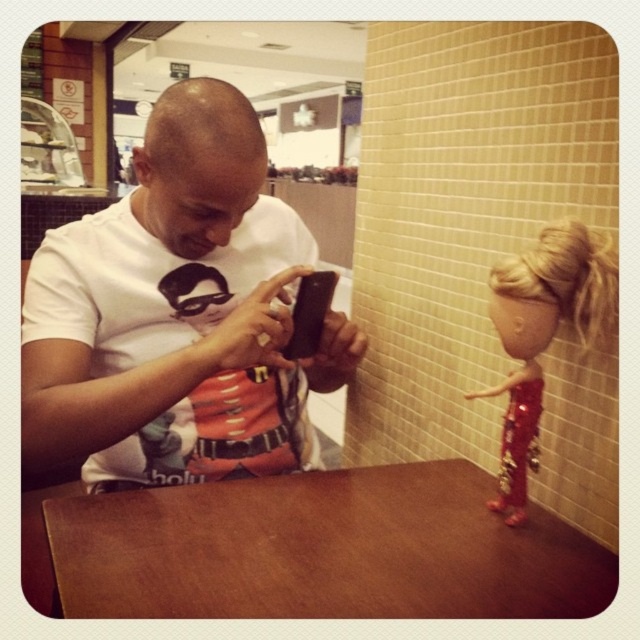
You are standing in the food court and want to find the brown matte table at lower center. According to the coordinates provided, can you locate it at point (323,550)?

Yes, the brown matte table at lower center is located exactly at point (323,550).

You are a photographer trying to capture the brown matte table at lower center and the black matte smartphone at center in a single shot. Based on their positions, which object will appear larger in the photo?

The brown matte table at lower center will appear larger in the photo because it is closer to the viewer than the black matte smartphone at center.

You are a delivery person who needs to place a small package on the brown matte table at lower center. The coordinates given are in a system where the bottom left corner of the image is the origin point. What direction should you move from the bottom left corner to reach the table?

The coordinates for the brown matte table at lower center are at point 0.861 on the x axis and 0.505 on the y axis. Since the bottom left corner is the origin, moving towards the right along the x axis and slightly upwards along the y axis will reach the table.